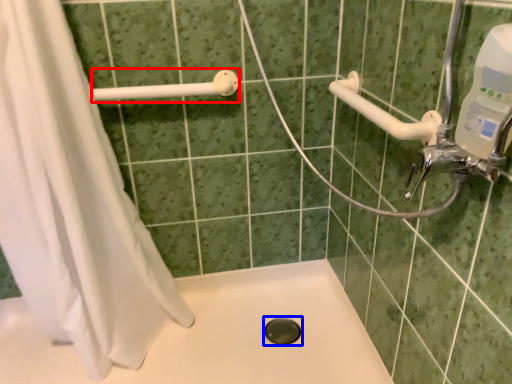
Question: Which object is further to the camera taking this photo, shower (highlighted by a red box) or hole (highlighted by a blue box)?

Choices:
 (A) shower
 (B) hole

Answer: (B)